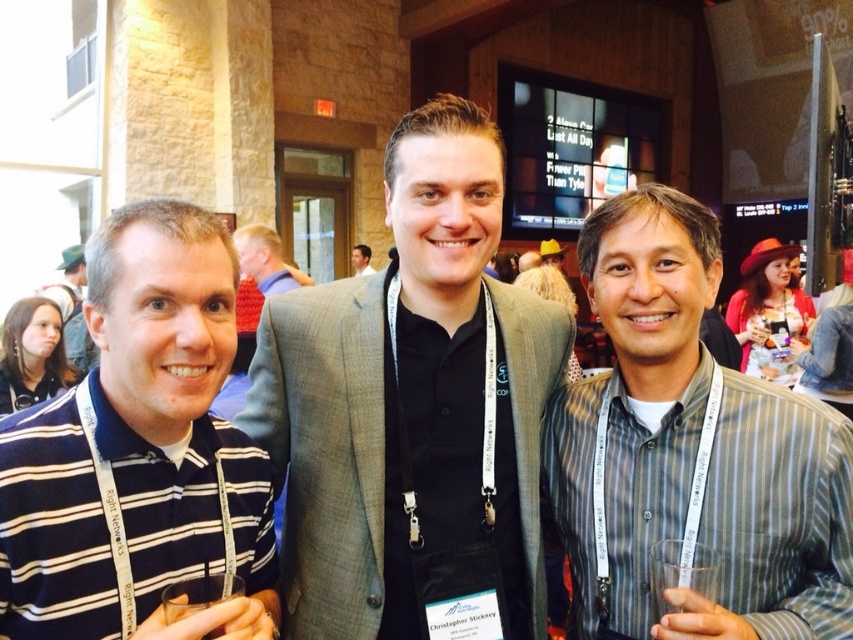
You are at a conference and need to find the person wearing the matte black shirt at left. Which direction should you look relative to the smooth black shirt at center?

The matte black shirt at left is located to the left of the smooth black shirt at center, so you should look to the left side of the smooth black shirt at center to find it.

You are a photographer standing 1.5 meters away from the matte gray suit at center. You want to take a closeup shot of the person wearing it. Is your current distance sufficient to capture a clear, detailed closeup without moving closer?

The matte gray suit at center is 1.22 meters from viewer. Since you are standing 1.5 meters away, which is slightly farther than the distance to the suit, you may need to move closer to ensure the closeup is clear and detailed.

You are a photographer trying to adjust the focus on your camera. The blue striped polo shirt at center and the light brown hair at center are both in the frame. Given their distance apart, can you focus on both subjects simultaneously if your camera has a depth of field that can cover 10 feet?

The blue striped polo shirt at center is 10.13 feet away from the light brown hair at center. Since the distance between them exceeds the camera lens depth of field coverage of 10 feet, focusing on both simultaneously may not be possible. Adjust the focus or settings for optimal clarity.